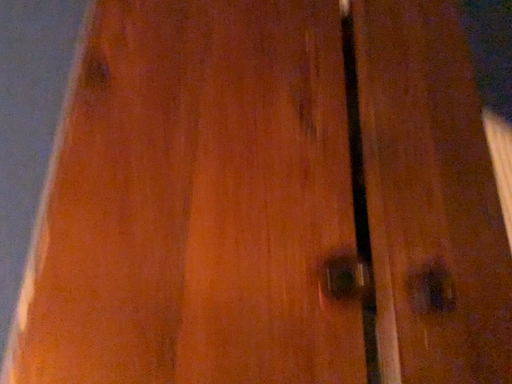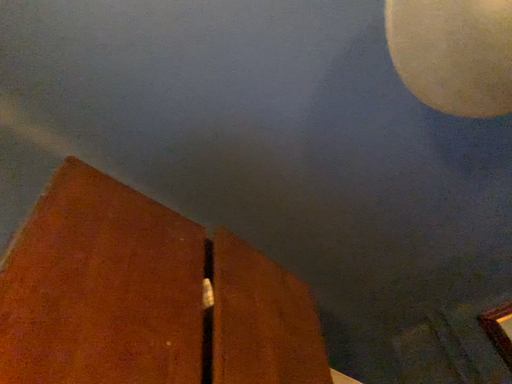
Question: Which way did the camera rotate in the video?

Choices:
 (A) rotated downward
 (B) rotated upward

Answer: (B)